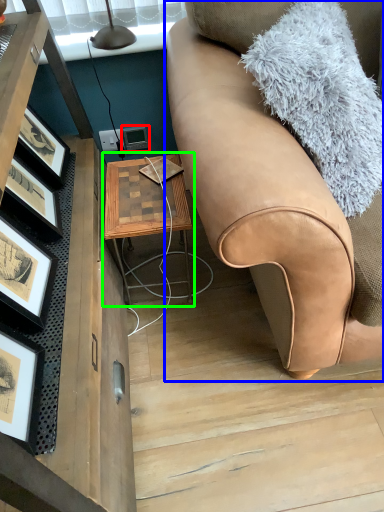
Question: Which object is positioned closest to picture frame (highlighted by a red box)? Select from studio couch (highlighted by a blue box) and table (highlighted by a green box).

Choices:
 (A) studio couch
 (B) table

Answer: (B)